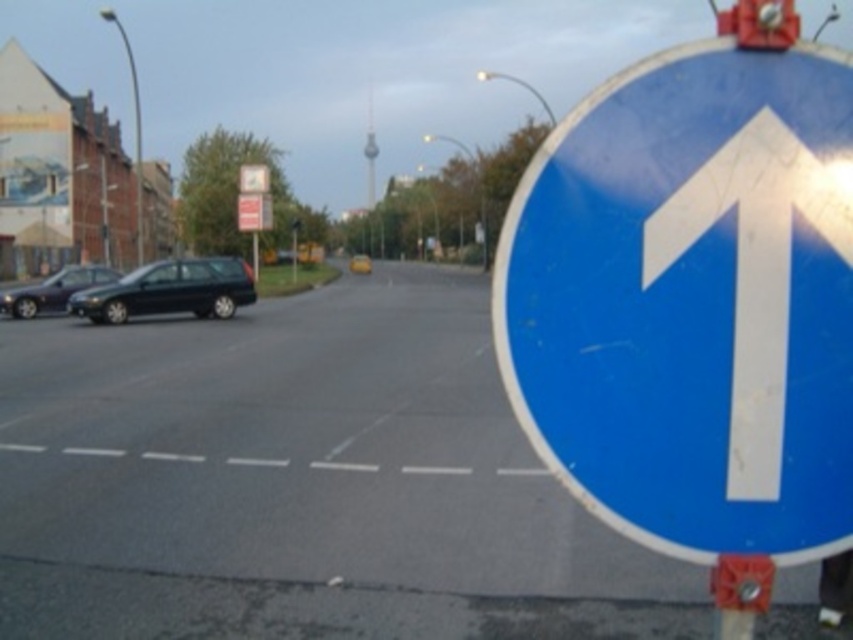
You are a delivery driver who needs to park your van between the shiny dark blue sedan at left and the matte black car at left. Your van is 15 feet long. Based on the scene, can you fit your van between them?

The shiny dark blue sedan at left and matte black car at left are 18.08 feet apart from each other. Since your van is 15 feet long, there is enough space to park between them as 15 feet is less than 18.08 feet.

You are a delivery driver who needs to park your truck, which is 2.2 meters tall, in this street scene. You see the shiny dark blue sedan at left and the matte black car at left. Which car is taller, and will your truck fit between them if parked there?

The shiny dark blue sedan at left is much taller than the matte black car at left. Since the truck is 2.2 meters tall, and the taller car is the shiny dark blue sedan at left, the truck may not fit between them if the height clearance is limited by the tallest vehicle present.

You are standing on the sidewalk and see the blue glossy sign at right. If you want to touch the sign, how many steps do you think you need to take? Assume each step is about 3 feet long.

The blue glossy sign at right is 6.13 feet away from the viewer. Since each step is about 3 feet long, you would need to take approximately 2 steps to reach it.